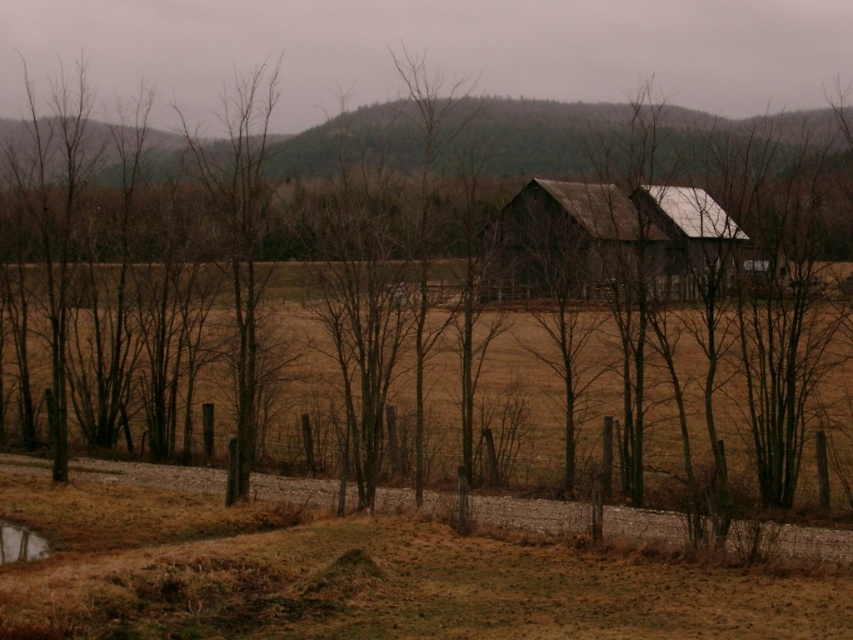
Does rusty metal barn at center have a smaller size compared to reflective wet surface at lower left?

Correct, rusty metal barn at center occupies less space than reflective wet surface at lower left.

Can you confirm if rusty metal barn at center is positioned to the left of reflective wet surface at lower left?

Incorrect, rusty metal barn at center is not on the left side of reflective wet surface at lower left.

What do you see at coordinates (608, 241) in the screenshot? I see `rusty metal barn at center` at bounding box center [608, 241].

Identify the location of rusty metal barn at center. (608, 241).